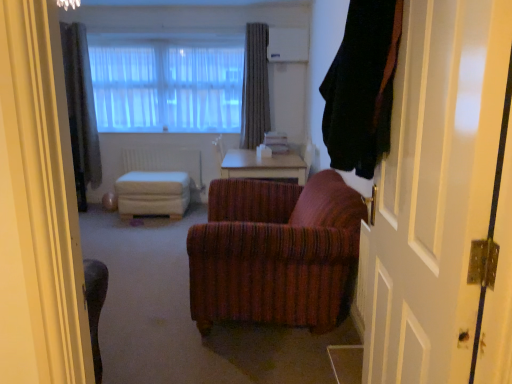
Question: Is light brown wooden table at center inside or outside of white matte radiator at center?

Choices:
 (A) outside
 (B) inside

Answer: (A)

Question: From a real-world perspective, is light brown wooden table at center physically located above or below white matte radiator at center?

Choices:
 (A) below
 (B) above

Answer: (B)

Question: Considering the real-world distances, which object is closest to the white fabric ottoman at center?

Choices:
 (A) black fabric curtain at right, positioned as the 3th curtain in left-to-right order
 (B) light brown wooden table at center
 (C) gray textured curtain at upper center, placed as the 3th curtain when sorted from front to back
 (D) white matte radiator at center
 (E) gray textured curtain at upper left, placed as the third curtain when sorted from right to left

Answer: (D)

Question: Which of these objects is positioned closest to the black fabric curtain at right, positioned as the 3th curtain in left-to-right order?

Choices:
 (A) light brown wooden table at center
 (B) gray textured curtain at upper center, which is counted as the 2th curtain, starting from the left
 (C) gray textured curtain at upper left, placed as the third curtain when sorted from right to left
 (D) white fabric ottoman at center
 (E) white matte radiator at center

Answer: (A)